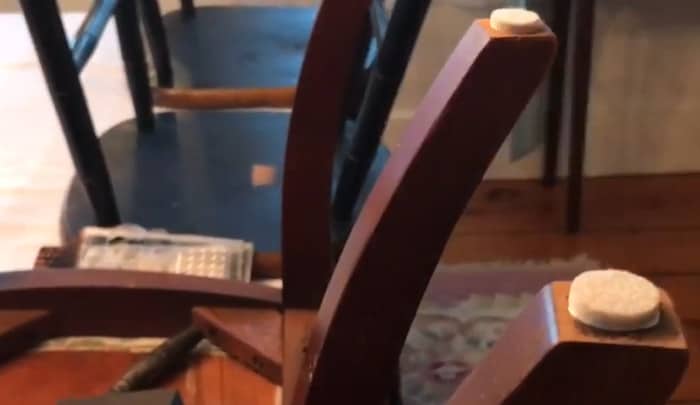
Where is `furniture pad`? furniture pad is located at coordinates (610, 304), (523, 20).